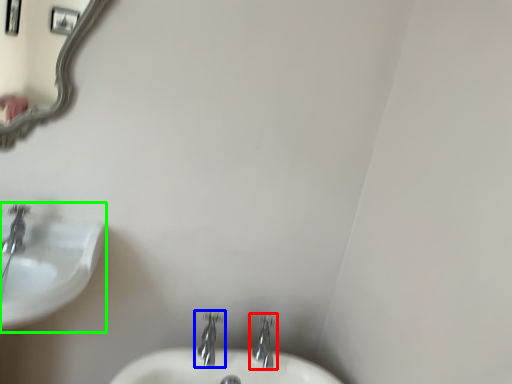
Question: Considering the real-world distances, which object is farthest from tap (highlighted by a red box)? tap (highlighted by a blue box) or sink (highlighted by a green box)?

Choices:
 (A) tap
 (B) sink

Answer: (B)